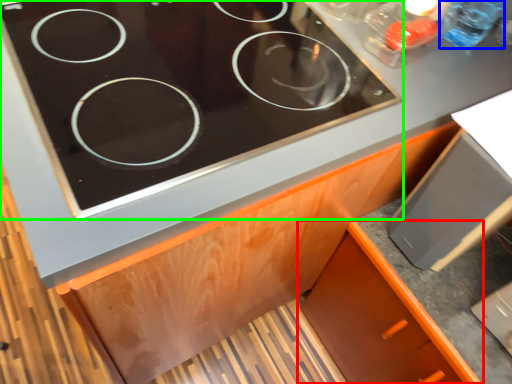
Question: Which is farther away from cabinetry (highlighted by a red box)? bottle (highlighted by a blue box) or gas stove (highlighted by a green box)?

Choices:
 (A) bottle
 (B) gas stove

Answer: (A)